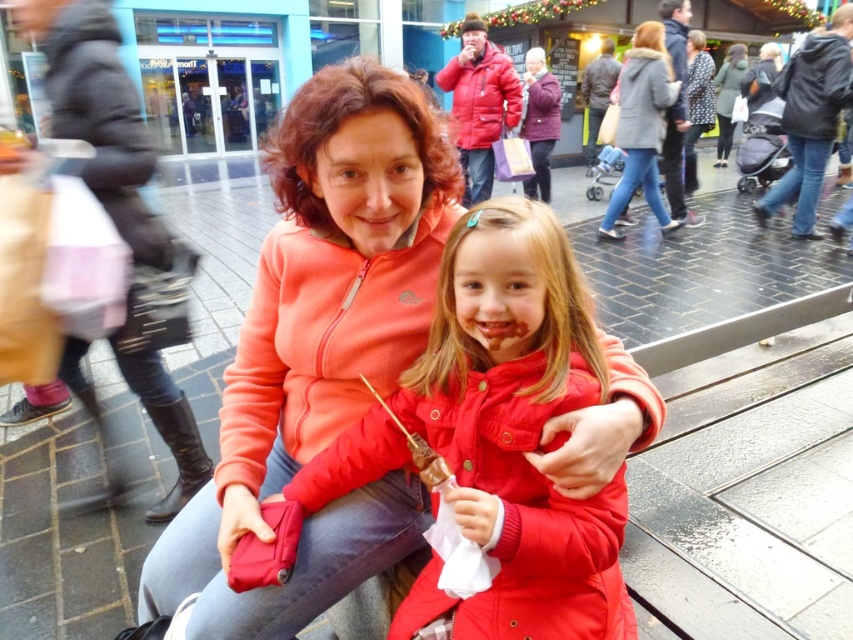
Looking at this image, what is the exact 2D coordinate of the matte red jacket at upper center in the image?

The matte red jacket at upper center is located at the coordinate point of (x=480, y=97).

You are a photographer trying to capture a clear shot of both the matte red jacket at upper center and the brown leather jacket at upper center. Since you want to ensure both are fully visible in your frame, which jacket should you focus on first to account for their sizes?

The matte red jacket at upper center is taller than the brown leather jacket at upper center, so you should focus on the matte red jacket at upper center first to ensure it fits within the frame, then adjust to include the smaller brown leather jacket at upper center.

You are standing at the point labeled as point (641, 125) in the image. Looking around, you see a gray wool coat at upper center. What is the nearest object to your current position?

The nearest object to your current position at point (641, 125) is the gray wool coat at upper center as it is directly indicated by the point.